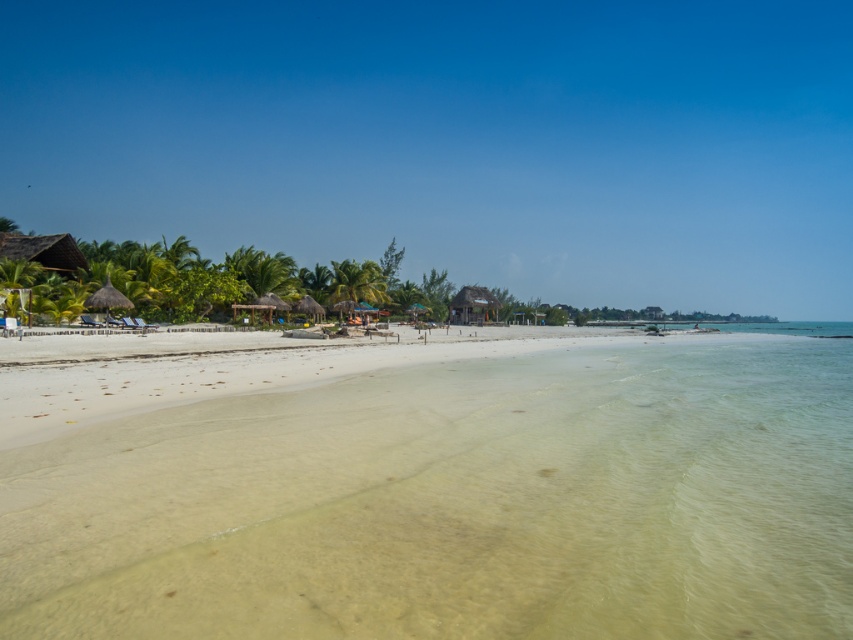
Question: Which object appears closest to the camera in this image?

Choices:
 (A) thatched roof hut at center
 (B) white sand beach at center

Answer: (B)

Question: Is white sand beach at center to the left of thatched roof hut at center from the viewer's perspective?

Choices:
 (A) yes
 (B) no

Answer: (A)

Question: Where is white sand beach at center located in relation to thatched roof hut at center in the image?

Choices:
 (A) right
 (B) left

Answer: (B)

Question: Which point appears closest to the camera in this image?

Choices:
 (A) (793, 428)
 (B) (485, 304)

Answer: (A)

Question: Does white sand beach at center have a larger size compared to thatched roof hut at center?

Choices:
 (A) yes
 (B) no

Answer: (B)

Question: Among these objects, which one is nearest to the camera?

Choices:
 (A) thatched roof hut at center
 (B) white sand beach at center

Answer: (B)